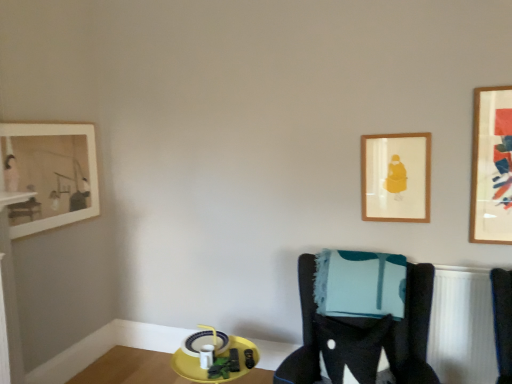
Question: Is yellow plastic tray at lower center located outside velvet black chair at center?

Choices:
 (A) yes
 (B) no

Answer: (A)

Question: Are yellow plastic tray at lower center and velvet black chair at center located far from each other?

Choices:
 (A) yes
 (B) no

Answer: (A)

Question: Is yellow plastic tray at lower center further to camera compared to velvet black chair at center?

Choices:
 (A) yes
 (B) no

Answer: (A)

Question: Does yellow plastic tray at lower center appear on the left side of velvet black chair at center?

Choices:
 (A) yes
 (B) no

Answer: (A)

Question: From a real-world perspective, is yellow plastic tray at lower center located higher than velvet black chair at center?

Choices:
 (A) no
 (B) yes

Answer: (A)

Question: Based on their positions, is yellow plastic tray at lower center located to the left or right of velvet black chair at center?

Choices:
 (A) left
 (B) right

Answer: (A)

Question: Is yellow plastic tray at lower center taller or shorter than velvet black chair at center?

Choices:
 (A) short
 (B) tall

Answer: (A)

Question: Is yellow plastic tray at lower center in front of or behind velvet black chair at center in the image?

Choices:
 (A) front
 (B) behind

Answer: (B)

Question: From the image's perspective, relative to velvet black chair at center, is yellow plastic tray at lower center above or below?

Choices:
 (A) below
 (B) above

Answer: (A)

Question: Would you say velvet black chair at center is to the left or to the right of wooden framed artwork at upper right, positioned as the first picture frame in right-to-left order, in the picture?

Choices:
 (A) right
 (B) left

Answer: (B)

Question: Is velvet black chair at center in front of or behind wooden framed artwork at upper right, positioned as the first picture frame in right-to-left order, in the image?

Choices:
 (A) front
 (B) behind

Answer: (A)

Question: Does point (283, 370) appear closer or farther from the camera than point (479, 145)?

Choices:
 (A) closer
 (B) farther

Answer: (A)

Question: Is velvet black chair at center bigger or smaller than wooden framed artwork at upper right, positioned as the first picture frame in right-to-left order?

Choices:
 (A) big
 (B) small

Answer: (A)

Question: Is yellow plastic tray at lower center inside the boundaries of matte white picture frame at upper left, the 1th picture frame viewed from the left, or outside?

Choices:
 (A) outside
 (B) inside

Answer: (A)

Question: Is point (153, 380) positioned closer to the camera than point (34, 226)?

Choices:
 (A) closer
 (B) farther

Answer: (B)